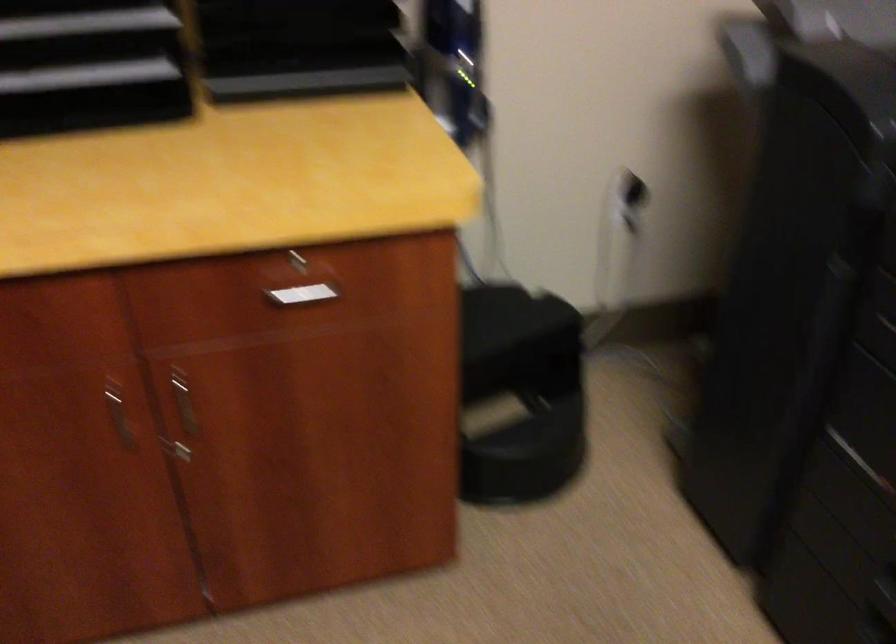
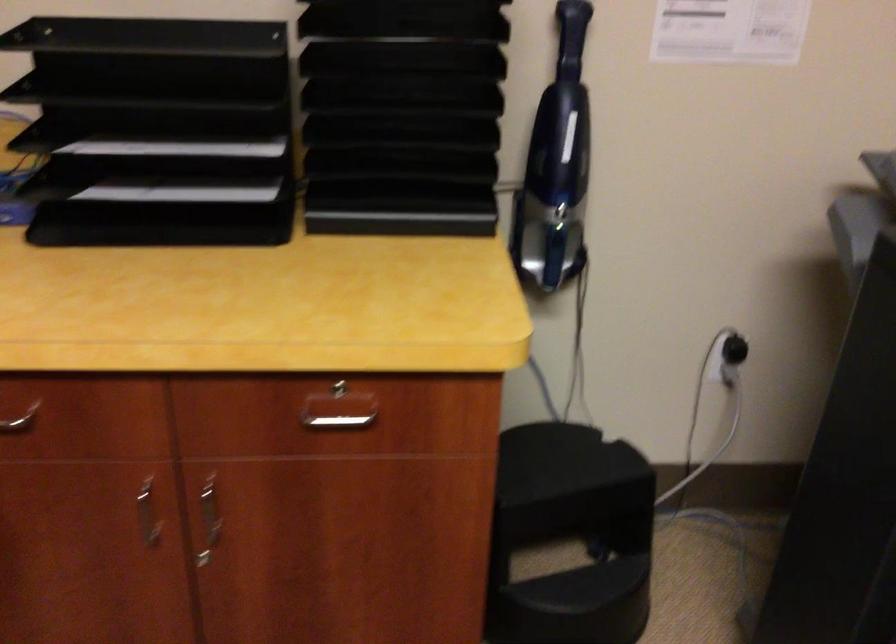
Question: The images are taken continuously from a first-person perspective. In which direction are you moving?

Choices:
 (A) Left
 (B) Right
 (C) Forward
 (D) Backward

Answer: (B)